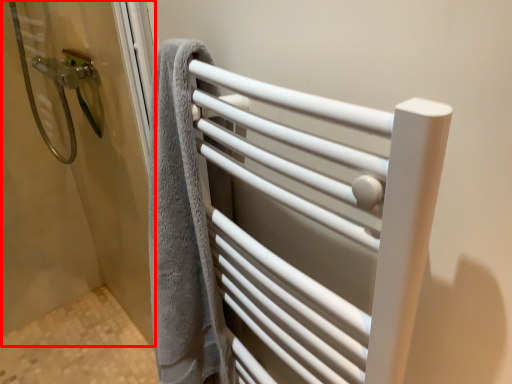
Question: Where is screen door (annotated by the red box) located in relation to towel rack in the image?

Choices:
 (A) left
 (B) right

Answer: (A)